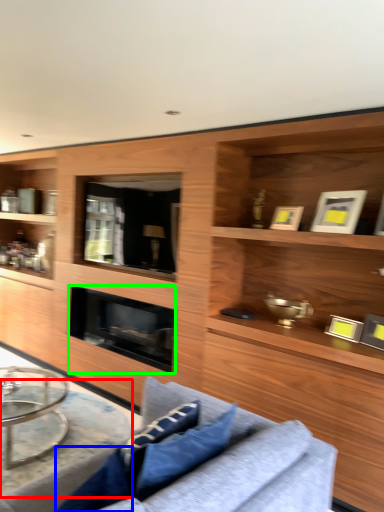
Question: Based on their relative distances, which object is nearer to round table (highlighted by a red box)? Choose from pillow (highlighted by a blue box) and fireplace (highlighted by a green box).

Choices:
 (A) pillow
 (B) fireplace

Answer: (B)